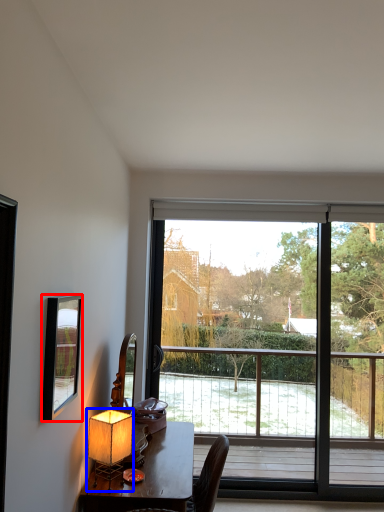
Question: Which of the following is the farthest to the observer, mirror (highlighted by a red box) or table lamp (highlighted by a blue box)?

Choices:
 (A) mirror
 (B) table lamp

Answer: (B)